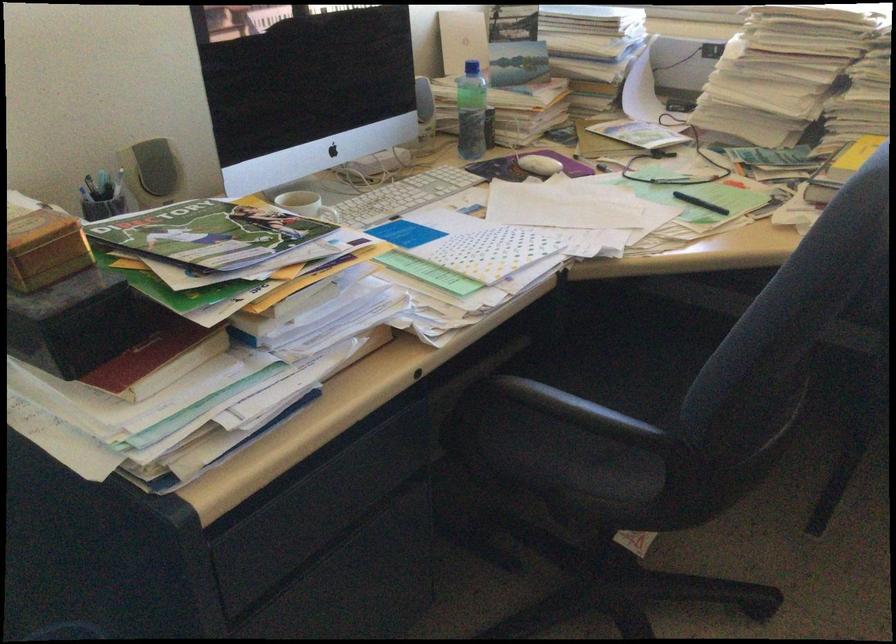
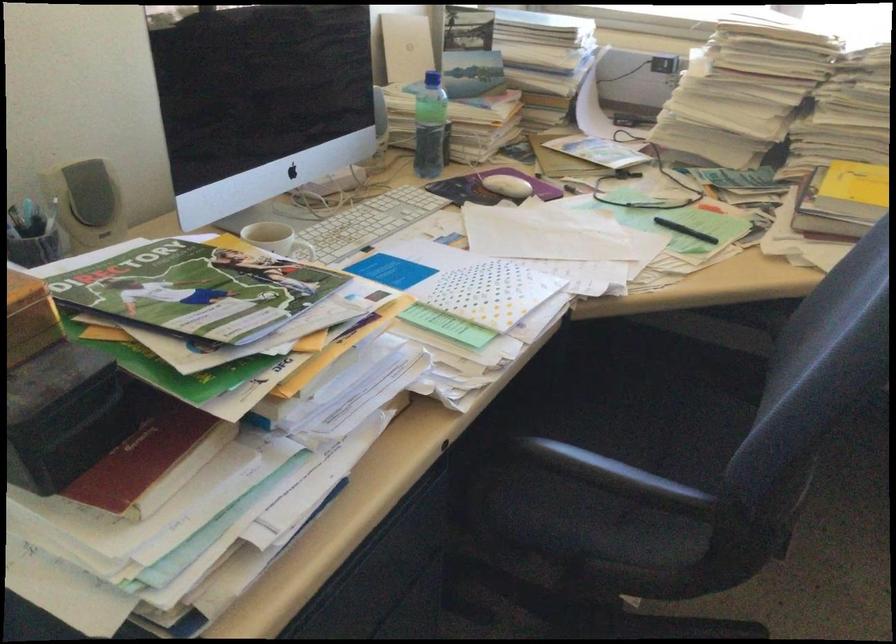
Where in the second image is the point corresponding to (x=538, y=163) from the first image?

(506, 185)